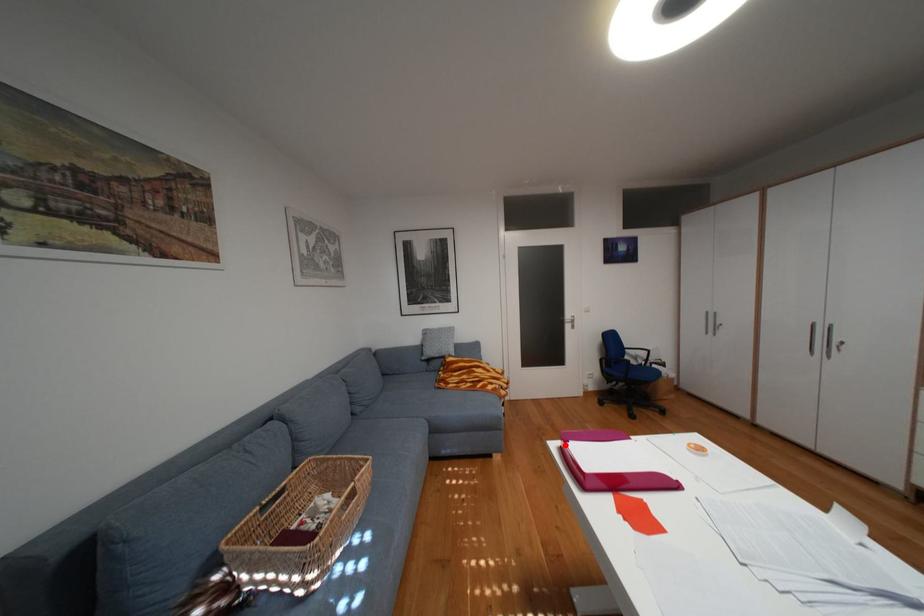
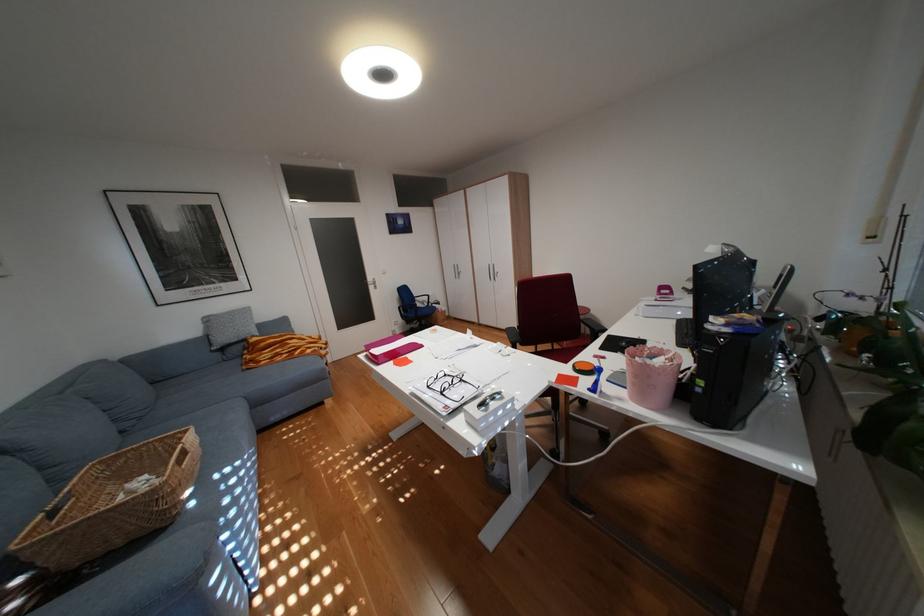
Question: I am providing you with two images of the same scene from different viewpoints. Given a red point in image1, look at the same physical point in image2. Is it:

Choices:
 (A) Closer to the viewpoint
 (B) Farther from the viewpoint

Answer: (B)